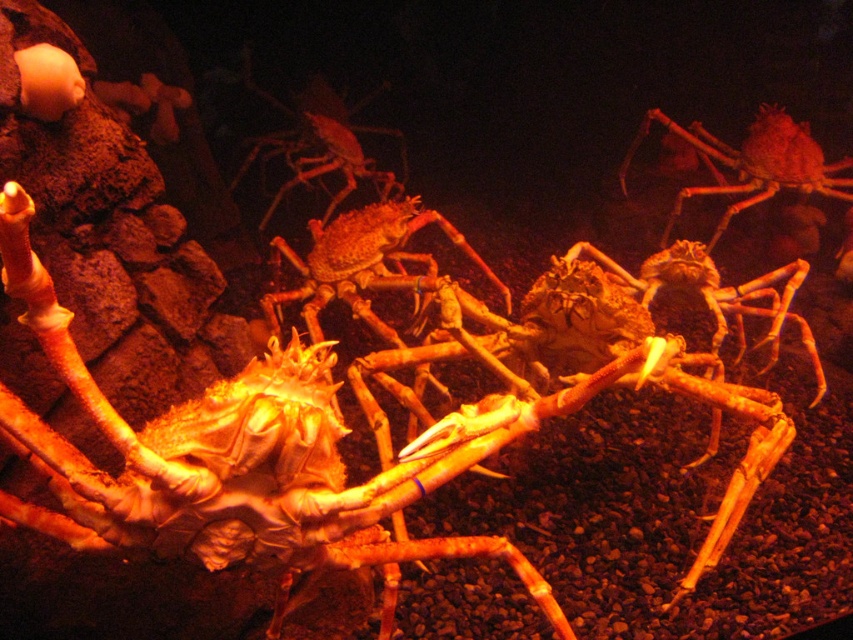
Question: Which of the following is the closest to the observer?

Choices:
 (A) smooth orange crab at center
 (B) smooth orange crab at upper right

Answer: (A)

Question: Does smooth orange crab at center appear on the right side of smooth orange crab at upper right?

Choices:
 (A) yes
 (B) no

Answer: (B)

Question: Which object appears farthest from the camera in this image?

Choices:
 (A) smooth orange crab at center
 (B) smooth orange crab at upper right

Answer: (B)

Question: Is smooth orange crab at center smaller than smooth orange crab at upper right?

Choices:
 (A) yes
 (B) no

Answer: (A)

Question: Can you confirm if smooth orange crab at center is smaller than smooth orange crab at upper right?

Choices:
 (A) yes
 (B) no

Answer: (A)

Question: Which point is farther to the camera?

Choices:
 (A) (695, 381)
 (B) (828, 186)

Answer: (B)